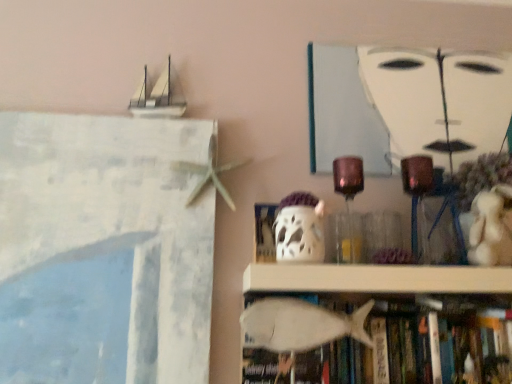
You are a GUI agent. You are given a task and a screenshot of the screen. Output one action in this format:
    pyautogui.click(x=<x>, y=<y>)
    Task: Click on the free space above white matte painting at upper center (from a real-world perspective)
    The width and height of the screenshot is (512, 384).
    Given the screenshot: What is the action you would take?
    pyautogui.click(x=406, y=46)